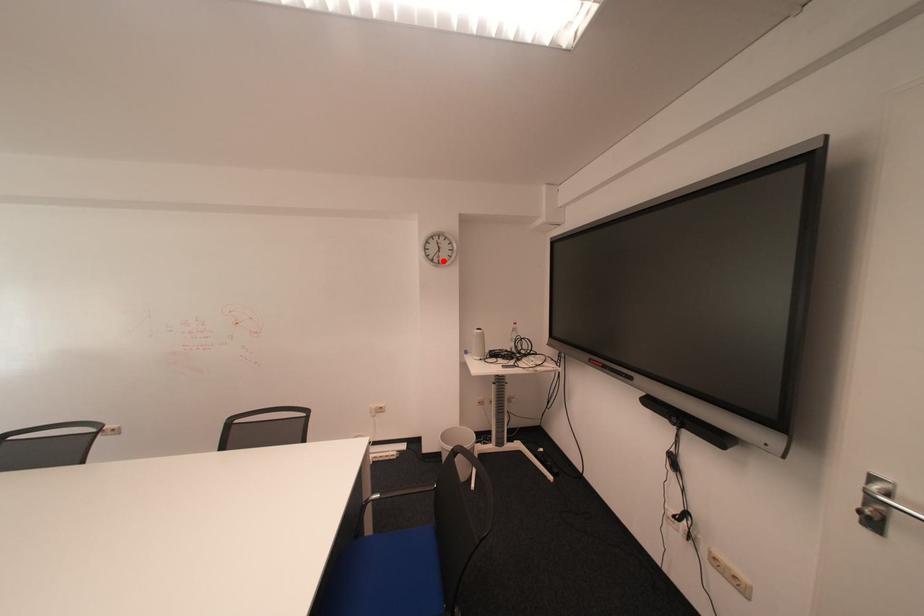
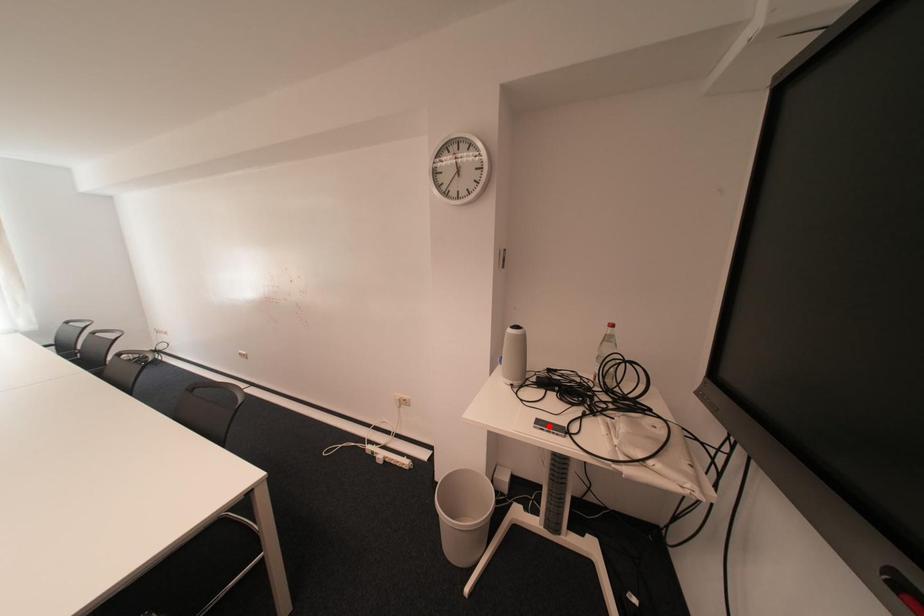
I am providing you with two images of the same scene from different viewpoints. A red point is marked on the first image and another point is marked on the second image. Is the marked point in image1 the same physical position as the marked point in image2?

No